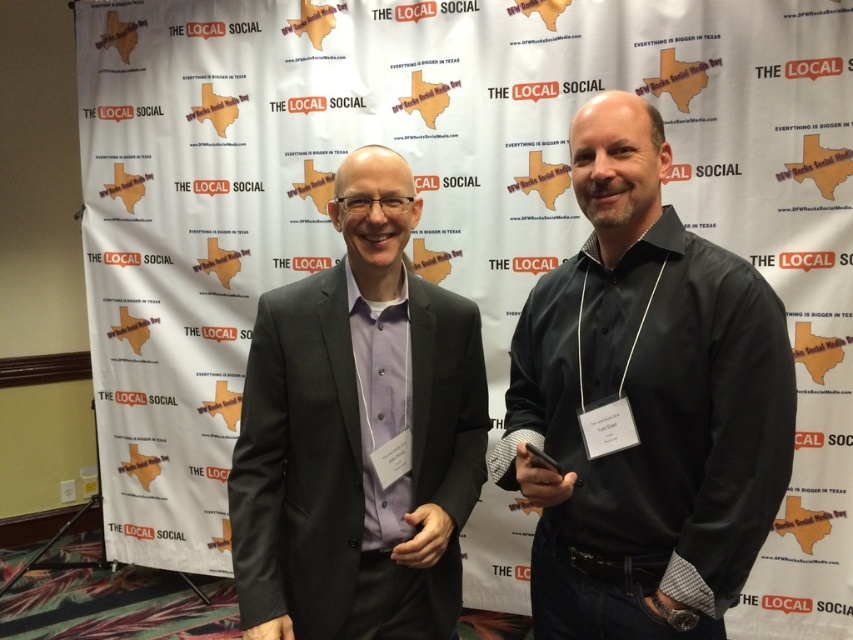
Question: Which point is farther to the camera?

Choices:
 (A) (608, 420)
 (B) (352, 396)

Answer: (B)

Question: Can you confirm if black matte shirt at right is positioned to the left of matte black suit at center?

Choices:
 (A) no
 (B) yes

Answer: (A)

Question: Is black matte shirt at right to the right of matte black suit at center from the viewer's perspective?

Choices:
 (A) yes
 (B) no

Answer: (A)

Question: Is black matte shirt at right positioned in front of matte black suit at center?

Choices:
 (A) yes
 (B) no

Answer: (A)

Question: Among these points, which one is nearest to the camera?

Choices:
 (A) (433, 536)
 (B) (647, 170)

Answer: (B)